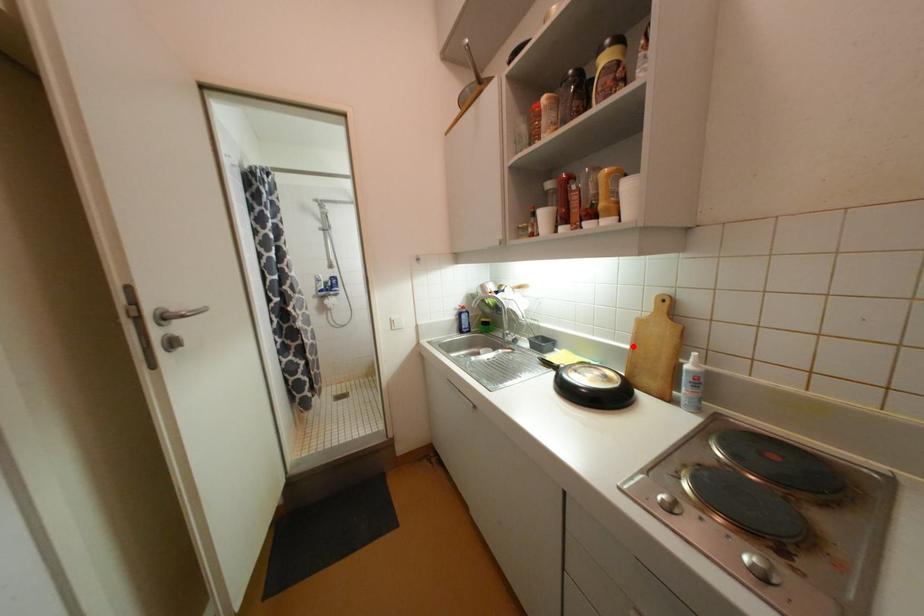
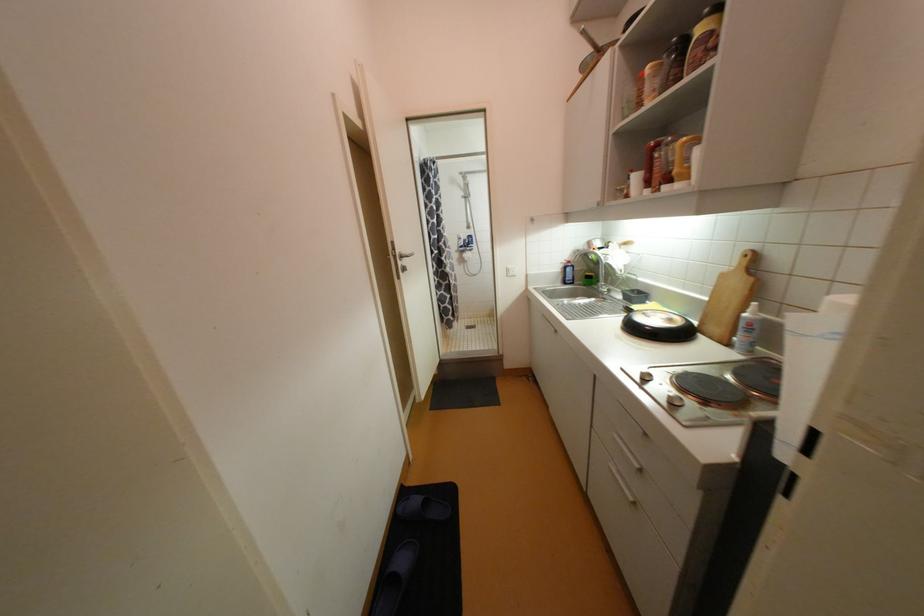
In the second image, find the point that corresponds to the highlighted location in the first image.

(712, 299)